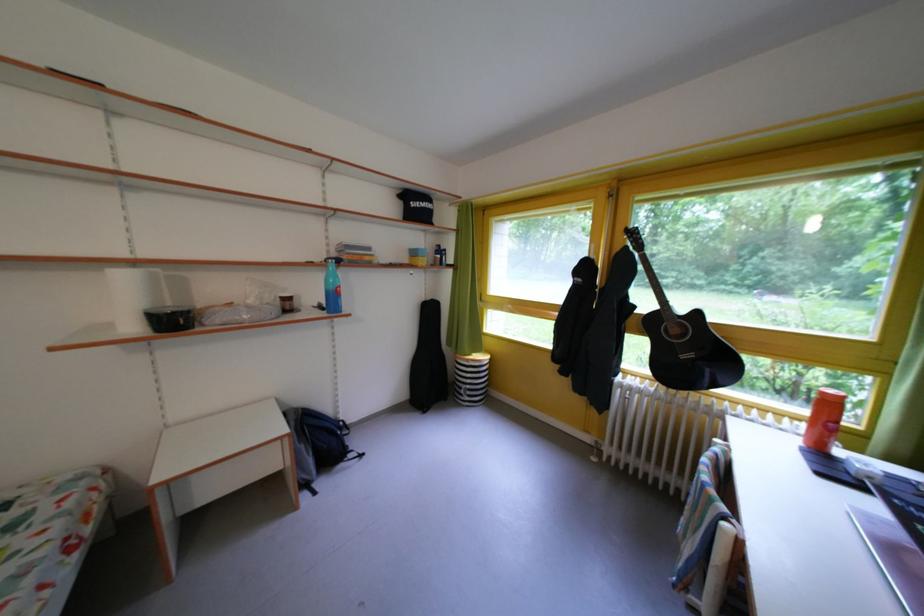
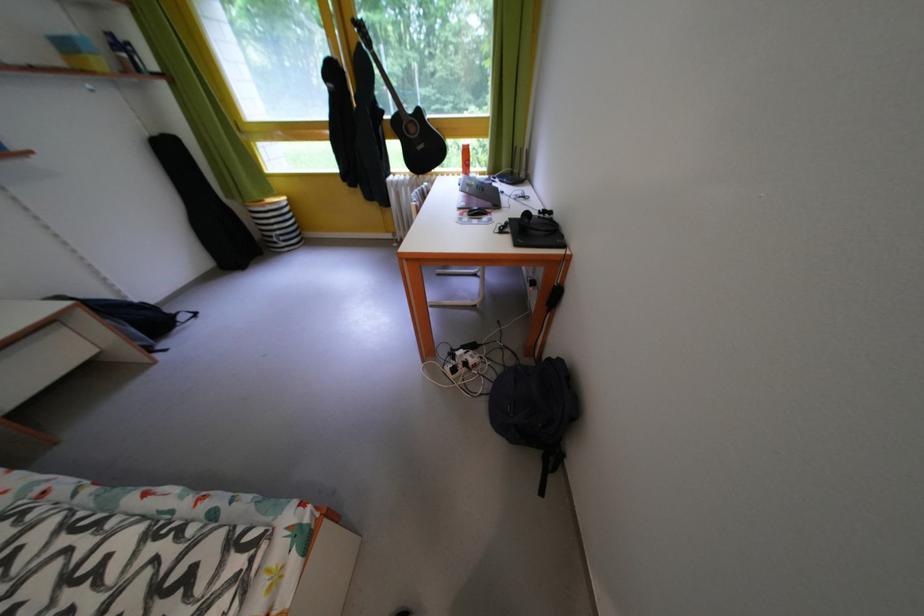
Locate, in the second image, the point that corresponds to pixel 439 304 in the first image.

(165, 139)